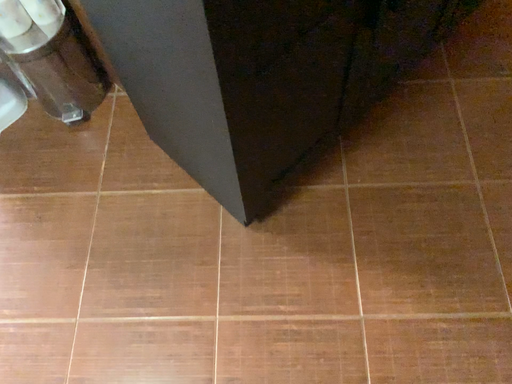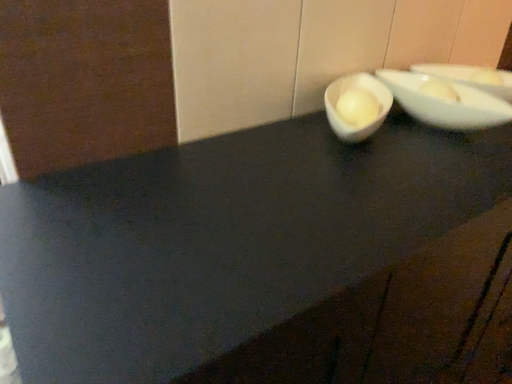
Question: How did the camera likely rotate when shooting the video?

Choices:
 (A) rotated upward
 (B) rotated downward

Answer: (A)